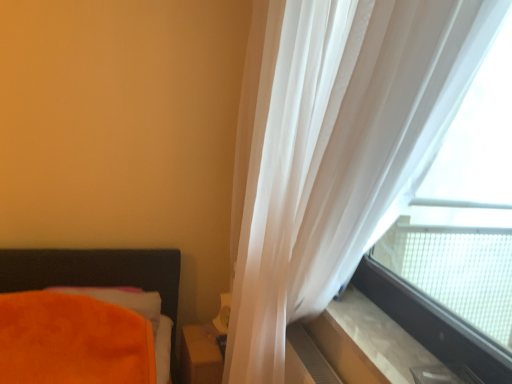
Question: Is matte brown wooden table at lower center outside translucent white curtain at right?

Choices:
 (A) yes
 (B) no

Answer: (B)

Question: From the image's perspective, would you say matte brown wooden table at lower center is positioned over translucent white curtain at right?

Choices:
 (A) yes
 (B) no

Answer: (B)

Question: Is matte brown wooden table at lower center closer to camera compared to translucent white curtain at right?

Choices:
 (A) yes
 (B) no

Answer: (B)

Question: Is translucent white curtain at right a part of matte brown wooden table at lower center?

Choices:
 (A) no
 (B) yes

Answer: (A)

Question: Does matte brown wooden table at lower center have a larger size compared to translucent white curtain at right?

Choices:
 (A) yes
 (B) no

Answer: (B)

Question: Can you confirm if matte brown wooden table at lower center is positioned to the right of translucent white curtain at right?

Choices:
 (A) no
 (B) yes

Answer: (A)

Question: From the image's perspective, does translucent fabric at upper right appear higher than orange plush pillow at lower left?

Choices:
 (A) yes
 (B) no

Answer: (A)

Question: Is translucent fabric at upper right placed right next to orange plush pillow at lower left?

Choices:
 (A) yes
 (B) no

Answer: (B)

Question: Considering the relative positions of translucent fabric at upper right and orange plush pillow at lower left in the image provided, is translucent fabric at upper right in front of orange plush pillow at lower left?

Choices:
 (A) no
 (B) yes

Answer: (B)

Question: Is translucent fabric at upper right outside orange plush pillow at lower left?

Choices:
 (A) yes
 (B) no

Answer: (A)

Question: Is translucent fabric at upper right behind orange plush pillow at lower left?

Choices:
 (A) no
 (B) yes

Answer: (A)

Question: Does translucent fabric at upper right have a greater width compared to orange plush pillow at lower left?

Choices:
 (A) yes
 (B) no

Answer: (B)

Question: Is translucent fabric at upper right at the left side of matte brown wooden table at lower center?

Choices:
 (A) no
 (B) yes

Answer: (A)